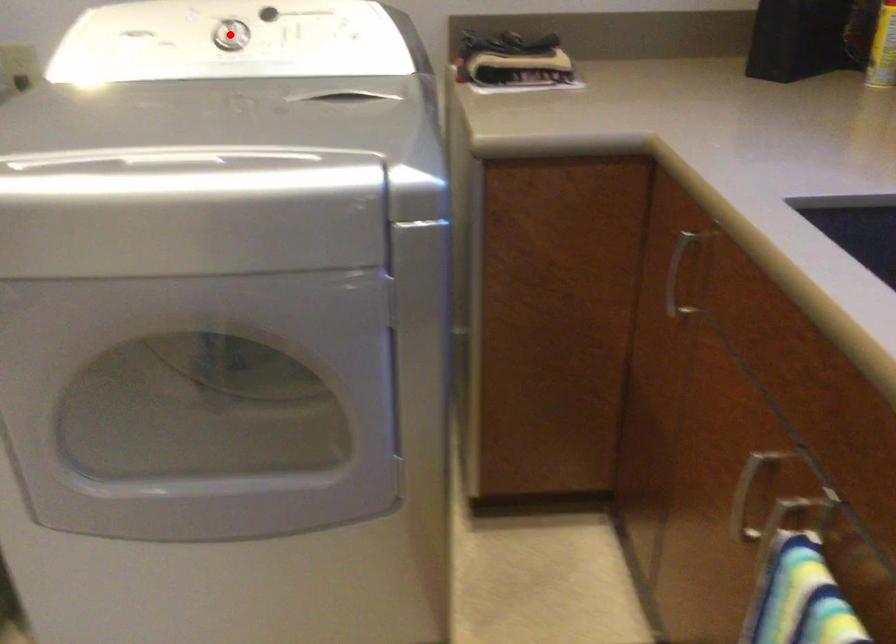
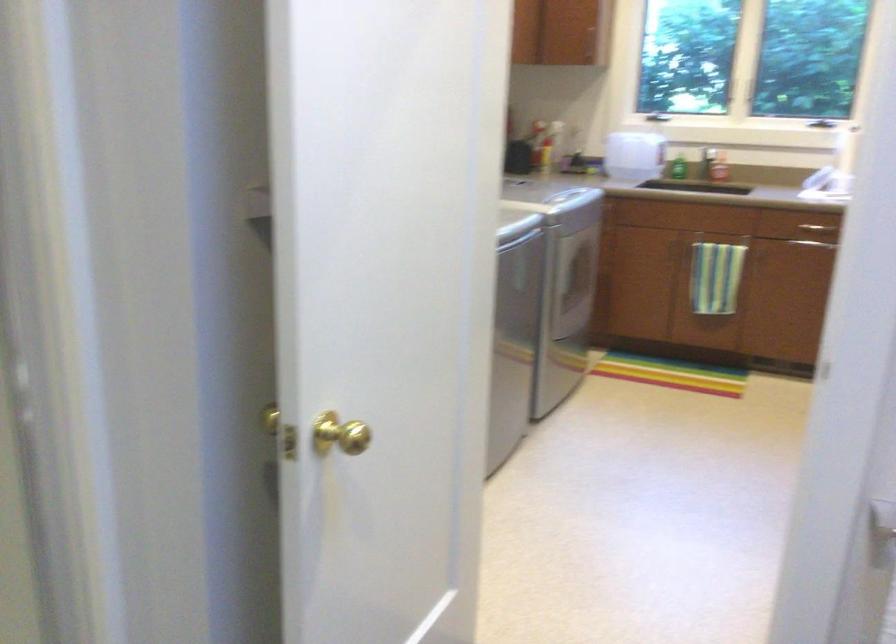
Question: I am providing you with two images of the same scene from different viewpoints. A red point is marked on the first image. At the location where the point appears in image 1, is it still visible in image 2?

Choices:
 (A) Yes
 (B) No

Answer: (B)